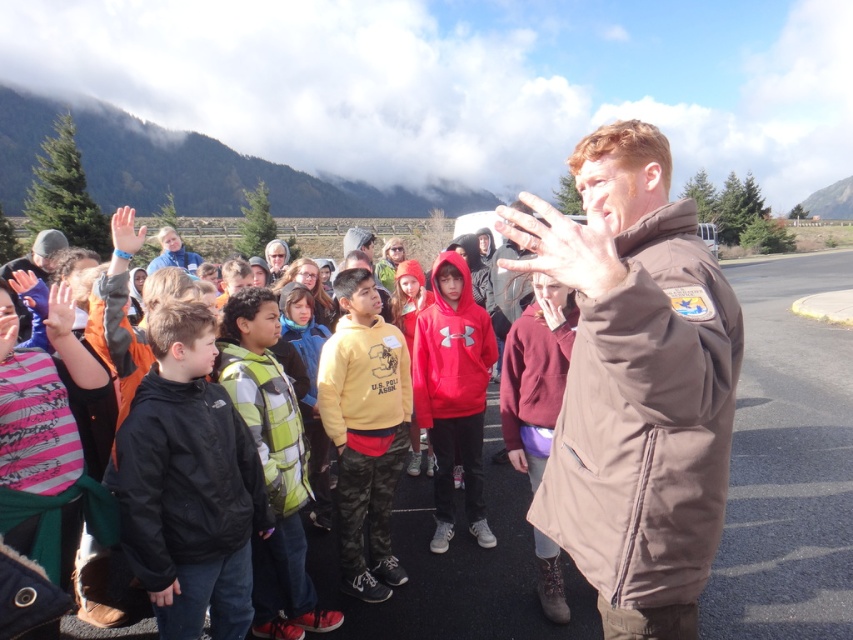
Question: Can you confirm if black matte jacket at center is smaller than maroon fleece at center?

Choices:
 (A) no
 (B) yes

Answer: (A)

Question: Which object is closer to the camera taking this photo?

Choices:
 (A) matte orange hand at upper left
 (B) red fleece hoodie at center
 (C) matte black hand at upper left

Answer: (C)

Question: Which point is closer to the camera?

Choices:
 (A) matte orange hand at upper left
 (B) matte black hand at upper left

Answer: (B)

Question: In this image, where is yellow fleece at center located relative to matte black hand at lower left?

Choices:
 (A) above
 (B) below

Answer: (B)

Question: Which of the following is the closest to the observer?

Choices:
 (A) black matte jacket at center
 (B) brown leather hand at center
 (C) matte black hand at lower left

Answer: (B)

Question: Is maroon fleece at center wider than matte black hand at lower left?

Choices:
 (A) yes
 (B) no

Answer: (A)